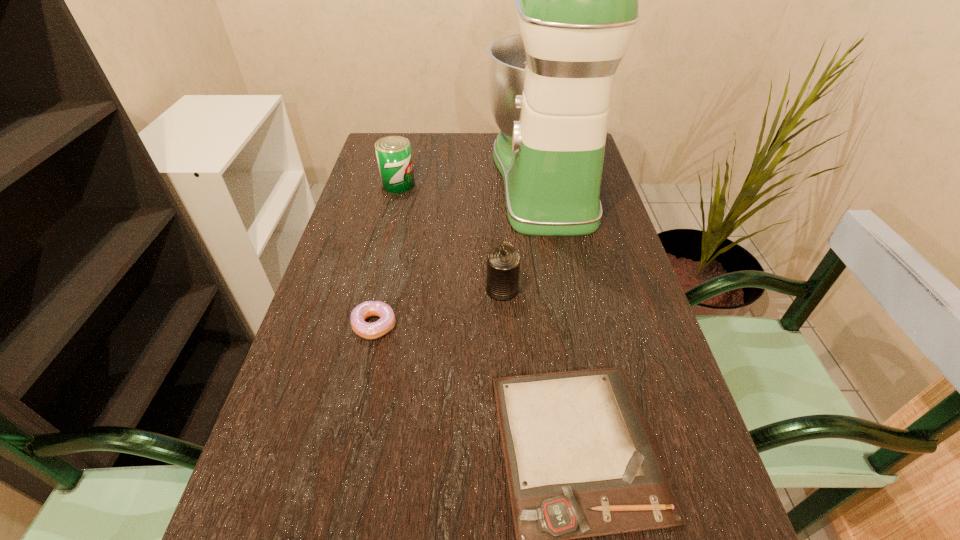
The height and width of the screenshot is (540, 960). Identify the location of free space between the mixer and the farther can. (471, 181).

Point out which object is positioned as the second nearest to the tallest object. Please provide its 2D coordinates. Your answer should be formatted as a tuple, i.e. [(x, y)], where the tuple contains the x and y coordinates of a point satisfying the conditions above.

[(393, 153)]

At what (x,y) coordinates should I click in order to perform the action: click on the fourth closest object to the second shortest object. Please return your answer as a coordinate pair (x, y). The width and height of the screenshot is (960, 540). Looking at the image, I should click on (576, 0).

You are a GUI agent. You are given a task and a screenshot of the screen. Output one action in this format:
    pyautogui.click(x=<x>, y=<y>)
    Task: Click on the free space in the image that satisfies the following two spatial constraints: 1. on the back side of the fourth nearest object; 2. on the right side of the third nearest object
    This screenshot has height=540, width=960.
    Given the screenshot: What is the action you would take?
    pyautogui.click(x=382, y=289)